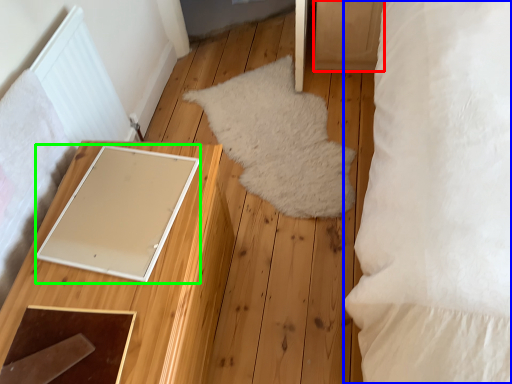
Question: Based on their relative distances, which object is nearer to drawer (highlighted by a red box)? Choose from pillow (highlighted by a blue box) and pad (highlighted by a green box).

Choices:
 (A) pillow
 (B) pad

Answer: (A)